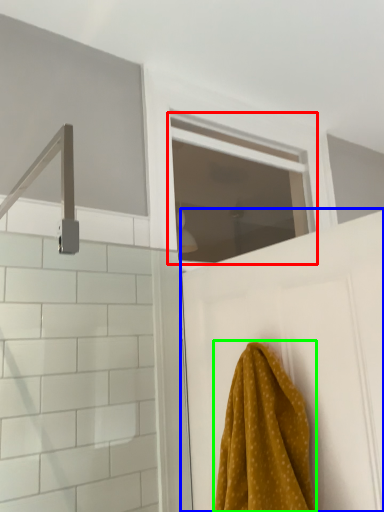
Question: Estimate the real-world distances between objects in this image. Which object is closer to window (highlighted by a red box), door (highlighted by a blue box) or towel (highlighted by a green box)?

Choices:
 (A) door
 (B) towel

Answer: (A)